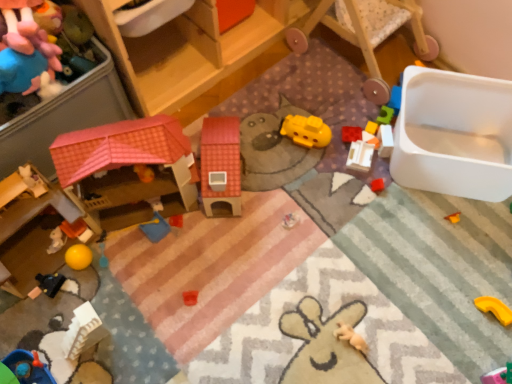
Where is `free space in front of rubber brick at upper right, placed as the 7th toy when sorted from left to right`? The width and height of the screenshot is (512, 384). free space in front of rubber brick at upper right, placed as the 7th toy when sorted from left to right is located at coordinates (353, 185).